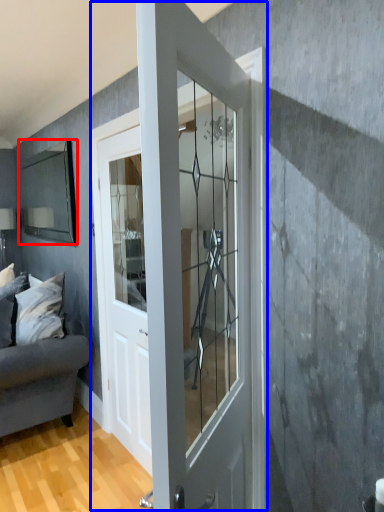
Question: Which object appears farthest to the camera in this image, mirror (highlighted by a red box) or door (highlighted by a blue box)?

Choices:
 (A) mirror
 (B) door

Answer: (A)